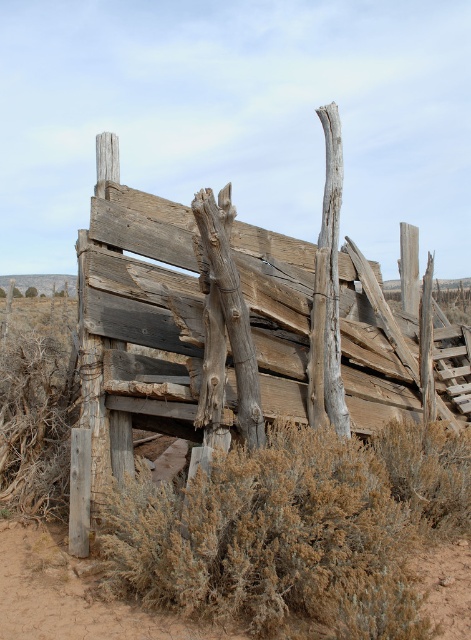
Can you confirm if weathered wood fence at center is taller than brown dry bush at lower center?

Yes, weathered wood fence at center is taller than brown dry bush at lower center.

Based on the photo, which is more to the right, weathered wood fence at center or brown dry bush at lower center?

Positioned to the right is brown dry bush at lower center.

What do you see at coordinates (237, 320) in the screenshot?
I see `weathered wood fence at center` at bounding box center [237, 320].

Identify the location of weathered wood fence at center. The height and width of the screenshot is (640, 471). coord(237,320).